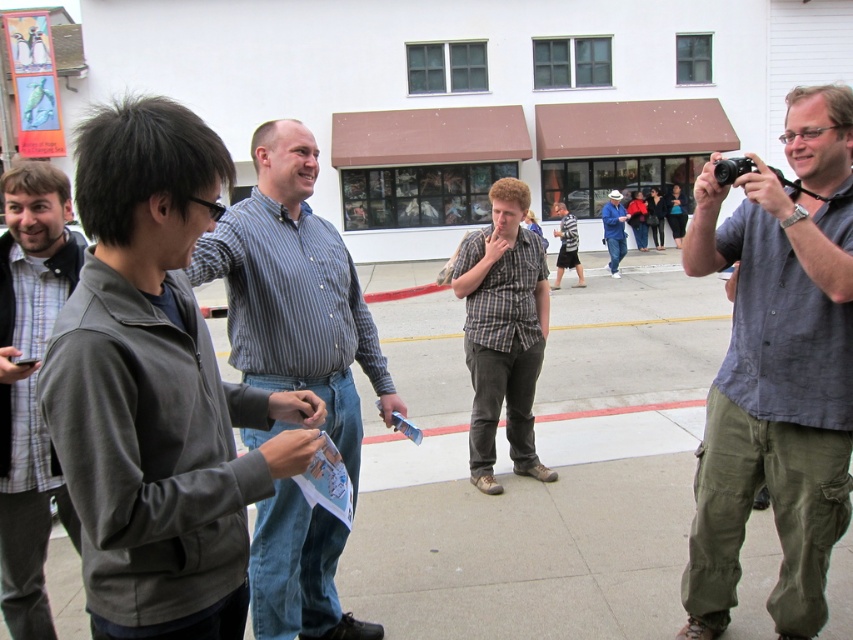
Question: Which of the following is the farthest from the observer?

Choices:
 (A) striped cotton shirt at center
 (B) gray linen shirt at right

Answer: (B)

Question: Which point is farther to the camera?

Choices:
 (A) (811, 438)
 (B) (276, 145)

Answer: (B)

Question: Can you confirm if striped cotton shirt at center is thinner than blue denim jeans at center?

Choices:
 (A) no
 (B) yes

Answer: (A)

Question: Among these points, which one is farthest from the camera?

Choices:
 (A) (38, 525)
 (B) (825, 321)
 (C) (535, 477)
 (D) (152, 209)

Answer: (C)

Question: Can you confirm if gray matte jacket at left is positioned below plaid shirt at center?

Choices:
 (A) no
 (B) yes

Answer: (B)

Question: Is gray matte jacket at left positioned behind plaid shirt at center?

Choices:
 (A) yes
 (B) no

Answer: (B)